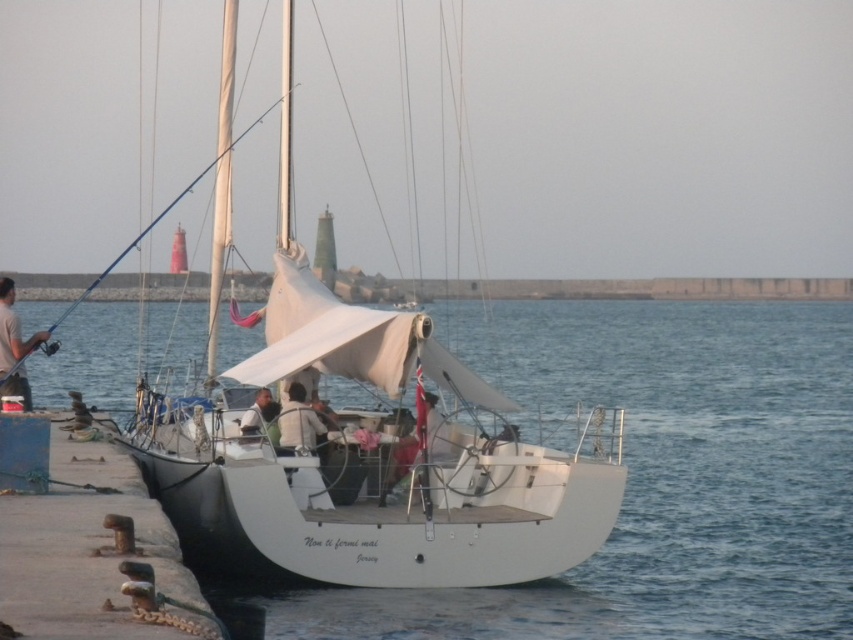
Between point (527, 301) and point (9, 282), which one is positioned behind?

Positioned behind is point (527, 301).

Does white matte water at center have a larger size compared to light brown leather jacket at left?

Indeed, white matte water at center has a larger size compared to light brown leather jacket at left.

Who is more forward, (x=514, y=342) or (x=1, y=294)?

Point (x=1, y=294)

Image resolution: width=853 pixels, height=640 pixels. Identify the location of white matte water at center. (659, 474).

This screenshot has height=640, width=853. What do you see at coordinates (367, 452) in the screenshot?
I see `white matte sailboat at center` at bounding box center [367, 452].

What do you see at coordinates (367, 452) in the screenshot? This screenshot has height=640, width=853. I see `white matte sailboat at center` at bounding box center [367, 452].

The height and width of the screenshot is (640, 853). I want to click on white matte sailboat at center, so click(367, 452).

Measure the distance between white matte water at center and camera.

white matte water at center is 18.15 meters from camera.

Which is in front, point (804, 628) or point (383, 451)?

Point (804, 628)

At what (x,y) coordinates should I click in order to perform the action: click on white matte water at center. Please return your answer as a coordinate pair (x, y). The image size is (853, 640). Looking at the image, I should click on (659, 474).